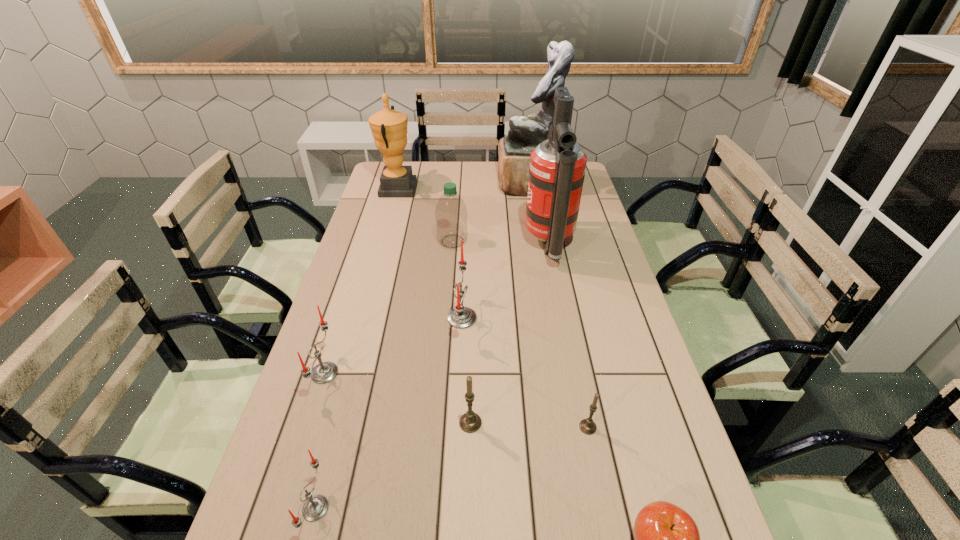
Where is `blank space located on the front-facing side of the farthest candle`? blank space located on the front-facing side of the farthest candle is located at coordinates (507, 318).

This screenshot has height=540, width=960. Identify the location of free space located on the left of the bigger gray candle. (330, 423).

Image resolution: width=960 pixels, height=540 pixels. Find the location of `vacant space located on the front-facing side of the fifth nearest object`. vacant space located on the front-facing side of the fifth nearest object is located at coordinates (428, 373).

You are a GUI agent. You are given a task and a screenshot of the screen. Output one action in this format:
    pyautogui.click(x=<x>, y=<y>)
    Task: Click on the vacant space located on the back of the right gray candle
    This screenshot has width=960, height=540.
    Given the screenshot: What is the action you would take?
    [581, 392]

The width and height of the screenshot is (960, 540). In order to click on sculpture that is at the far edge in this screenshot , I will do `click(525, 133)`.

Locate an element on the screen. award that is at the far edge is located at coordinates (389, 127).

I want to click on award situated at the left edge, so click(x=389, y=127).

This screenshot has width=960, height=540. In order to click on candle that is positioned at the left edge in this screenshot , I will do `click(324, 372)`.

Where is `sculpture that is at the right edge`? sculpture that is at the right edge is located at coordinates (525, 133).

The image size is (960, 540). Find the location of `fire extinguisher at the right edge`. fire extinguisher at the right edge is located at coordinates (557, 168).